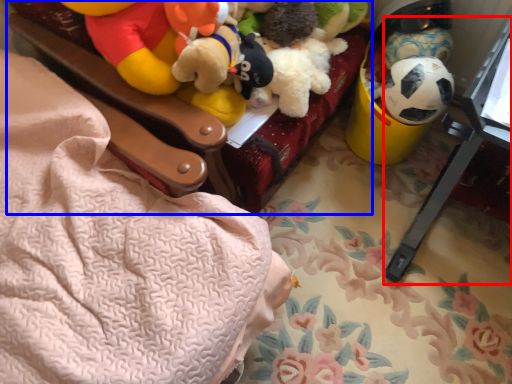
Question: Which of the following is the closest to the observer, changing table (highlighted by a red box) or furniture (highlighted by a blue box)?

Choices:
 (A) changing table
 (B) furniture

Answer: (A)